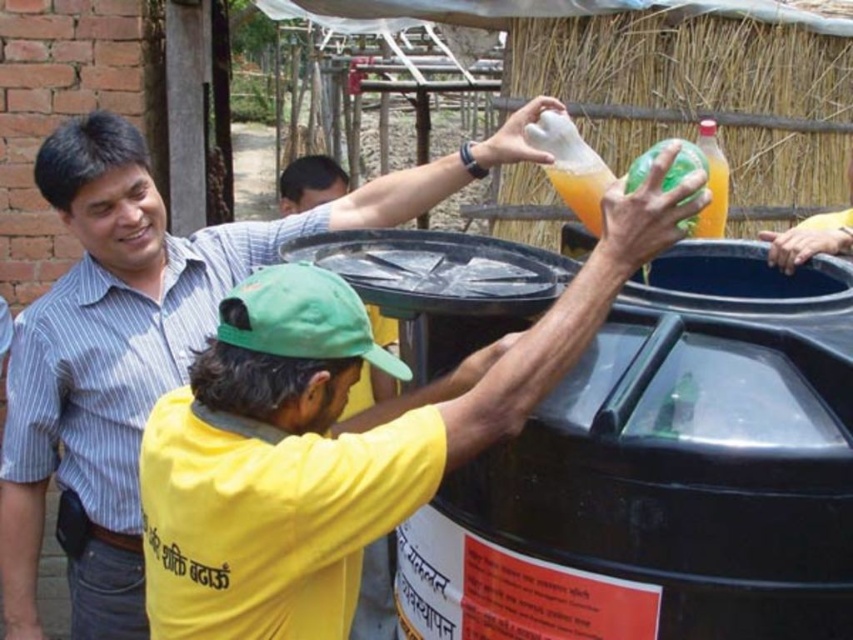
Can you confirm if matte black shirt at center is smaller than yellow matte shirt at center?

Incorrect, matte black shirt at center is not smaller in size than yellow matte shirt at center.

Looking at this image, can you confirm if matte black shirt at center is shorter than yellow matte shirt at center?

No, matte black shirt at center is not shorter than yellow matte shirt at center.

Between point (126, 428) and point (373, 595), which one is positioned in front?

Point (126, 428) is more forward.

Find the location of a particular element. Image resolution: width=853 pixels, height=640 pixels. matte black shirt at center is located at coordinates (144, 342).

Is matte black shirt at center smaller than translucent plastic bottle at upper right?

No, matte black shirt at center is not smaller than translucent plastic bottle at upper right.

Is matte black shirt at center to the left of translucent plastic bottle at upper right from the viewer's perspective?

Yes, matte black shirt at center is to the left of translucent plastic bottle at upper right.

Is point (109, 481) closer to viewer compared to point (722, 224)?

Yes.

The image size is (853, 640). Find the location of `matte black shirt at center`. matte black shirt at center is located at coordinates (144, 342).

The height and width of the screenshot is (640, 853). Identify the location of yellow matte shirt at center. click(x=376, y=593).

Measure the distance between point [378,609] and camera.

Point [378,609] is 3.63 meters from camera.

Where is `yellow matte shirt at center`? This screenshot has width=853, height=640. yellow matte shirt at center is located at coordinates (376, 593).